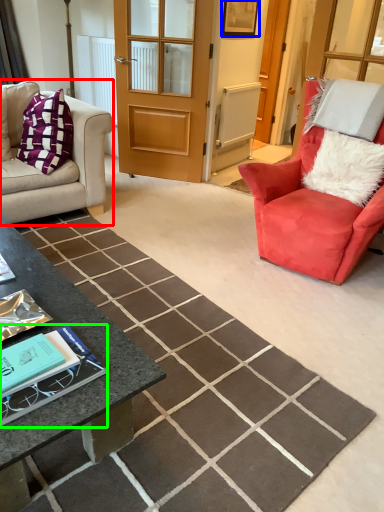
Question: Which is farther away from studio couch (highlighted by a red box)? picture frame (highlighted by a blue box) or book (highlighted by a green box)?

Choices:
 (A) picture frame
 (B) book

Answer: (B)